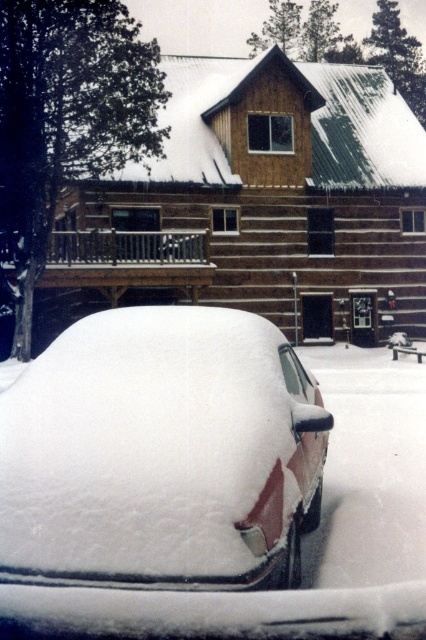
You are standing at the coordinates where the wooden cabin at center is located. Which direction should you face to see the car buried under snow?

Since the wooden cabin at center is at point (261, 202), you should face north to see the car buried under snow.